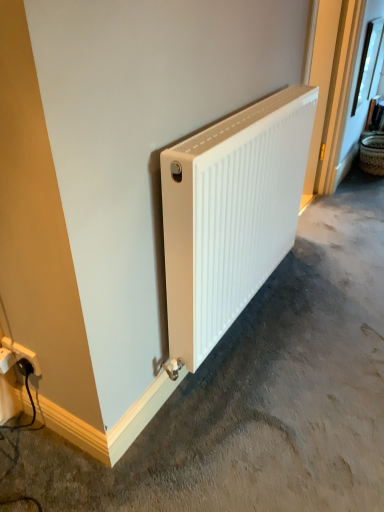
Question: Considering the relative sizes of white plastic power plugs and sockets at lower left and white matte radiator at center in the image provided, is white plastic power plugs and sockets at lower left smaller than white matte radiator at center?

Choices:
 (A) no
 (B) yes

Answer: (B)

Question: Are white plastic power plugs and sockets at lower left and white matte radiator at center located far from each other?

Choices:
 (A) yes
 (B) no

Answer: (B)

Question: Does white plastic power plugs and sockets at lower left have a lesser width compared to white matte radiator at center?

Choices:
 (A) no
 (B) yes

Answer: (B)

Question: Is white plastic power plugs and sockets at lower left placed right next to white matte radiator at center?

Choices:
 (A) no
 (B) yes

Answer: (A)

Question: Can you confirm if white plastic power plugs and sockets at lower left is positioned to the right of white matte radiator at center?

Choices:
 (A) yes
 (B) no

Answer: (B)

Question: Is white plastic power plugs and sockets at lower left behind white matte radiator at center?

Choices:
 (A) yes
 (B) no

Answer: (A)

Question: Does white matte radiator at center have a greater width compared to woven brown basket at right?

Choices:
 (A) yes
 (B) no

Answer: (A)

Question: From the image's perspective, is white matte radiator at center beneath woven brown basket at right?

Choices:
 (A) no
 (B) yes

Answer: (B)

Question: Is white matte radiator at center completely or partially outside of woven brown basket at right?

Choices:
 (A) no
 (B) yes

Answer: (B)

Question: Is white matte radiator at center oriented away from woven brown basket at right?

Choices:
 (A) yes
 (B) no

Answer: (B)

Question: Is white matte radiator at center bigger than woven brown basket at right?

Choices:
 (A) no
 (B) yes

Answer: (B)

Question: From a real-world perspective, is white matte radiator at center on top of woven brown basket at right?

Choices:
 (A) no
 (B) yes

Answer: (A)

Question: From a real-world perspective, does white matte radiator at center sit lower than white matte radiator at center?

Choices:
 (A) yes
 (B) no

Answer: (B)